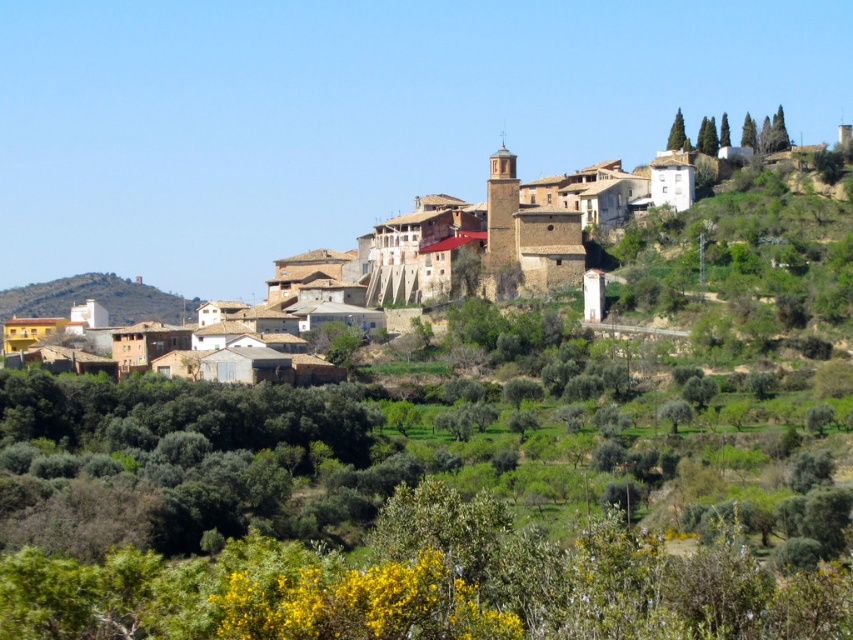
Is brown stone buildings at center bigger than brown textured hillside at left?

Yes, brown stone buildings at center is bigger than brown textured hillside at left.

Does point (622, 308) come farther from viewer compared to point (129, 305)?

No.

What are the coordinates of `brown stone buildings at center` in the screenshot? It's located at (737, 246).